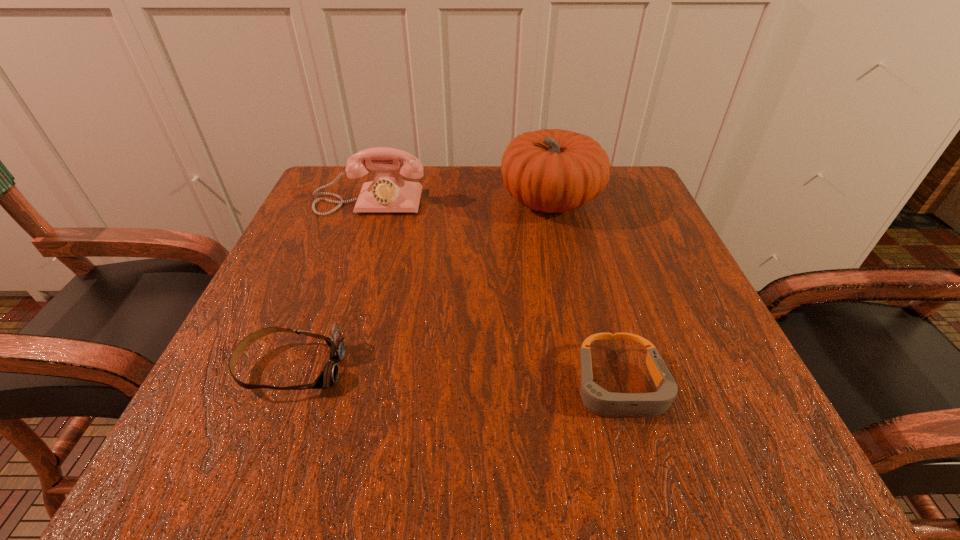
Identify the location of free spot between the pumpkin and the second tallest object. (460, 201).

Image resolution: width=960 pixels, height=540 pixels. I want to click on vacant space in between the left goggles and the right goggles, so click(455, 377).

Where is `free space between the right goggles and the telephone`? free space between the right goggles and the telephone is located at coordinates (494, 294).

Locate an element on the screen. empty space between the telephone and the left goggles is located at coordinates (330, 285).

The height and width of the screenshot is (540, 960). Find the location of `vacant area that lies between the third shortest object and the right goggles`. vacant area that lies between the third shortest object and the right goggles is located at coordinates (494, 294).

What are the coordinates of `object that is the closest one to the right goggles` in the screenshot? It's located at (551, 170).

I want to click on object that can be found as the closest to the telephone, so click(551, 170).

Image resolution: width=960 pixels, height=540 pixels. I want to click on blank space that satisfies the following two spatial constraints: 1. on the dial of the third shortest object; 2. on the front-facing side of the left goggles, so click(x=313, y=368).

Identify the location of vacant area that satisfies the following two spatial constraints: 1. on the dial of the telephone; 2. on the front-facing side of the left goggles. (313, 368).